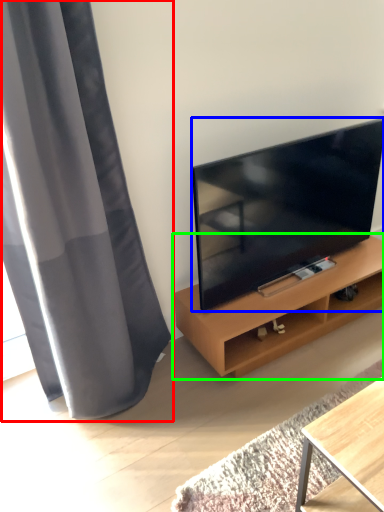
Question: Considering the real-world distances, which object is farthest from curtain (highlighted by a red box)? television (highlighted by a blue box) or shelf (highlighted by a green box)?

Choices:
 (A) television
 (B) shelf

Answer: (B)